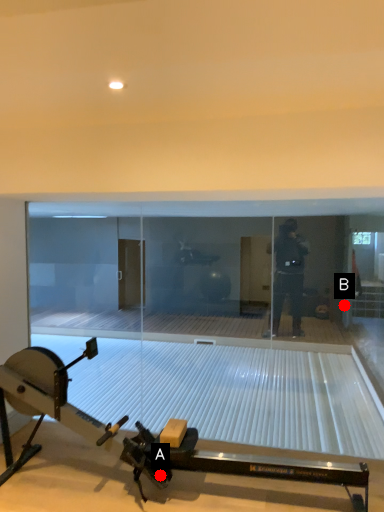
Question: Two points are circled on the image, labeled by A and B beside each circle. Which point appears closest to the camera in this image?

Choices:
 (A) A is closer
 (B) B is closer

Answer: (A)